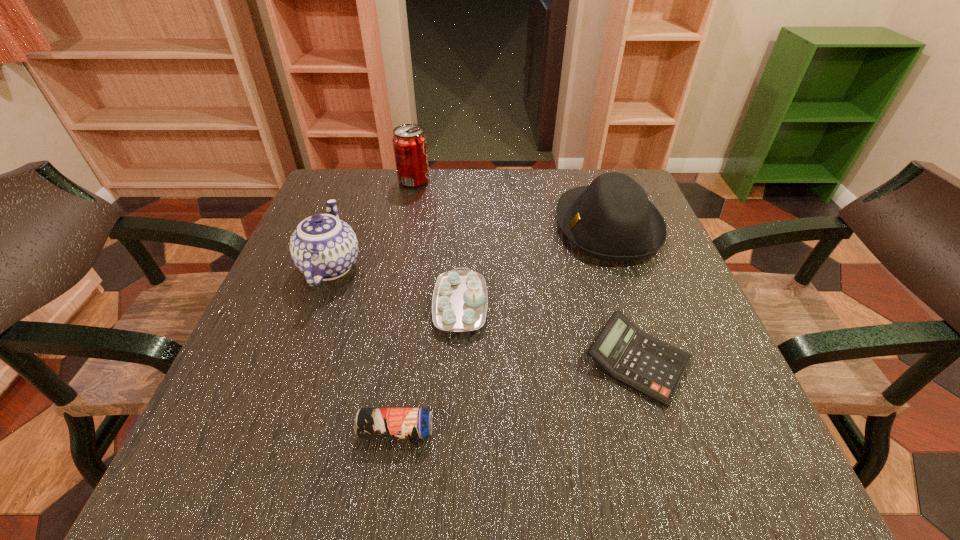
I want to click on vacant area that lies between the fedora and the calculator, so click(x=623, y=294).

Identify the location of vacant area that lies between the fedora and the right chinaware. (534, 266).

This screenshot has height=540, width=960. Find the location of `vacant space that is in between the leftmost object and the fedora`. vacant space that is in between the leftmost object and the fedora is located at coordinates (469, 246).

I want to click on unoccupied area between the pop soda and the beer can, so click(x=405, y=306).

You are a GUI agent. You are given a task and a screenshot of the screen. Output one action in this format:
    pyautogui.click(x=<x>, y=<y>)
    Task: Click on the unoccupied area between the fedora and the shortest object
    
    Given the screenshot: What is the action you would take?
    pyautogui.click(x=623, y=294)

Locate an element on the screen. This screenshot has height=540, width=960. free space between the fedora and the shorter chinaware is located at coordinates pyautogui.click(x=534, y=266).

Identify the location of empty space that is in between the shortest object and the nearest object. (516, 396).

I want to click on free space that is in between the fourth tallest object and the fedora, so click(534, 266).

Find the location of a particular element. free space between the fedora and the nearest object is located at coordinates (502, 328).

I want to click on object that is the closest to the taller chinaware, so click(460, 300).